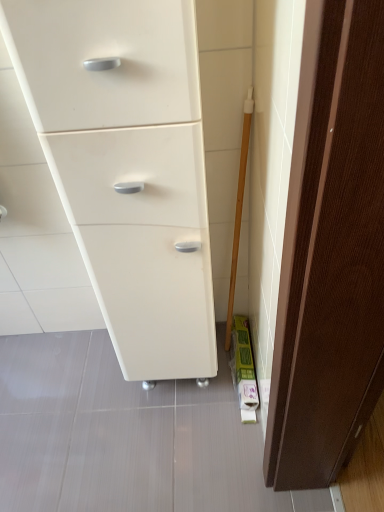
The height and width of the screenshot is (512, 384). Describe the element at coordinates (127, 167) in the screenshot. I see `white plastic chest of drawers at center` at that location.

At what (x,y) coordinates should I click in order to perform the action: click on white plastic chest of drawers at center. Please return your answer as a coordinate pair (x, y). Looking at the image, I should click on (127, 167).

Image resolution: width=384 pixels, height=512 pixels. In order to click on white plastic chest of drawers at center in this screenshot , I will do `click(127, 167)`.